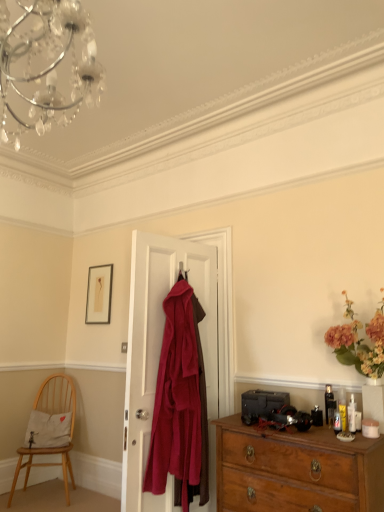
This screenshot has width=384, height=512. Identify the location of wooden chest of drawers at lower right. (296, 470).

At what (x,y) coordinates should I click in order to perform the action: click on matte gold picture frame at upper left. Please return your answer as a coordinate pair (x, y). This screenshot has height=512, width=384. Looking at the image, I should click on 99,294.

Is velvet burgundy coat at center a part of light wood chair at lower left?

That's incorrect, velvet burgundy coat at center is not inside light wood chair at lower left.

Is light wood chair at lower left touching velvet burgundy coat at center?

No.

Is light wood chair at lower left to the right of velvet burgundy coat at center from the viewer's perspective?

No, light wood chair at lower left is not to the right of velvet burgundy coat at center.

Is light wood chair at lower left in front of or behind velvet burgundy coat at center in the image?

In the image, light wood chair at lower left appears behind velvet burgundy coat at center.

Can you see wooden chest of drawers at lower right touching matte gold picture frame at upper left?

They are not placed beside each other.

Is wooden chest of drawers at lower right taller or shorter than matte gold picture frame at upper left?

Considering their sizes, wooden chest of drawers at lower right has more height than matte gold picture frame at upper left.

Locate an element on the screen. picture frame above the wooden chest of drawers at lower right (from a real-world perspective) is located at coordinates (99, 294).

How many degrees apart are the facing directions of wooden chest of drawers at lower right and matte gold picture frame at upper left?

wooden chest of drawers at lower right and matte gold picture frame at upper left are facing 0.288 degrees away from each other.

Can you tell me how much matte gold picture frame at upper left and velvet burgundy coat at center differ in facing direction?

They differ by 96.5 degrees in their facing directions.

Is matte gold picture frame at upper left positioned with its back to velvet burgundy coat at center?

No, matte gold picture frame at upper left is not facing the opposite direction of velvet burgundy coat at center.

Is point (103, 317) closer to viewer compared to point (159, 303)?

No.

Consider the image. Does matte gold picture frame at upper left have a lesser height compared to velvet burgundy coat at center?

Indeed, matte gold picture frame at upper left has a lesser height compared to velvet burgundy coat at center.

From the image's perspective, is wooden chest of drawers at lower right above or below velvet burgundy coat at center?

Based on their image positions, wooden chest of drawers at lower right is located beneath velvet burgundy coat at center.

Can you confirm if wooden chest of drawers at lower right is thinner than velvet burgundy coat at center?

Incorrect, the width of wooden chest of drawers at lower right is not less than that of velvet burgundy coat at center.

Based on their sizes in the image, would you say wooden chest of drawers at lower right is bigger or smaller than velvet burgundy coat at center?

Considering their sizes, wooden chest of drawers at lower right takes up more space than velvet burgundy coat at center.

Is wooden chest of drawers at lower right not within velvet burgundy coat at center?

Absolutely, wooden chest of drawers at lower right is external to velvet burgundy coat at center.

Between velvet burgundy coat at center and light wood chair at lower left, which one has less height?

With less height is light wood chair at lower left.

Can you tell me how much velvet burgundy coat at center and light wood chair at lower left differ in facing direction?

The angular difference between velvet burgundy coat at center and light wood chair at lower left is 141 degrees.

Is light wood chair at lower left at the back of velvet burgundy coat at center?

No, velvet burgundy coat at center is not facing away from light wood chair at lower left.

Between velvet burgundy coat at center and light wood chair at lower left, which one appears on the left side from the viewer's perspective?

light wood chair at lower left is more to the left.

Would you consider wooden chest of drawers at lower right to be distant from light wood chair at lower left?

wooden chest of drawers at lower right is far away from light wood chair at lower left.

Can you confirm if wooden chest of drawers at lower right is positioned to the left of light wood chair at lower left?

No.

Is wooden chest of drawers at lower right oriented away from light wood chair at lower left?

No.

Is velvet burgundy coat at center positioned behind wooden chest of drawers at lower right?

Yes, velvet burgundy coat at center is behind wooden chest of drawers at lower right.

Which is less distant, (144,237) or (299,497)?

The point (299,497) is more forward.

From a real-world perspective, between velvet burgundy coat at center and wooden chest of drawers at lower right, who is vertically lower?

wooden chest of drawers at lower right, from a real-world perspective.

Measure the distance from velvet burgundy coat at center to wooden chest of drawers at lower right.

velvet burgundy coat at center is 24.95 inches away from wooden chest of drawers at lower right.

I want to click on door on the right of light wood chair at lower left, so click(160, 350).

The height and width of the screenshot is (512, 384). Find the location of `the chest of drawers lying below the matte gold picture frame at upper left (from the image's perspective)`. the chest of drawers lying below the matte gold picture frame at upper left (from the image's perspective) is located at coordinates (296, 470).

Based on their spatial positions, is wooden chest of drawers at lower right or matte gold picture frame at upper left closer to light wood chair at lower left?

Among the two, matte gold picture frame at upper left is located nearer to light wood chair at lower left.

Looking at the image, which one is located further to wooden chest of drawers at lower right, matte gold picture frame at upper left or light wood chair at lower left?

Among the two, light wood chair at lower left is located further to wooden chest of drawers at lower right.

Based on their spatial positions, is velvet burgundy coat at center or matte gold picture frame at upper left further from wooden chest of drawers at lower right?

Based on the image, matte gold picture frame at upper left appears to be further to wooden chest of drawers at lower right.

From the image, which object appears to be farther from wooden chest of drawers at lower right, velvet burgundy coat at center or light wood chair at lower left?

Among the two, light wood chair at lower left is located further to wooden chest of drawers at lower right.

From the image, which object appears to be nearer to matte gold picture frame at upper left, light wood chair at lower left or wooden chest of drawers at lower right?

The object closer to matte gold picture frame at upper left is light wood chair at lower left.

Which object lies further to the anchor point wooden chest of drawers at lower right, matte gold picture frame at upper left or velvet burgundy coat at center?

Based on the image, matte gold picture frame at upper left appears to be further to wooden chest of drawers at lower right.

In the scene shown: Considering their positions, is light wood chair at lower left positioned further to matte gold picture frame at upper left than velvet burgundy coat at center?

Among the two, velvet burgundy coat at center is located further to matte gold picture frame at upper left.

Looking at the image, which one is located closer to velvet burgundy coat at center, matte gold picture frame at upper left or wooden chest of drawers at lower right?

The object closer to velvet burgundy coat at center is wooden chest of drawers at lower right.

At what (x,y) coordinates should I click in order to perform the action: click on door located between wooden chest of drawers at lower right and matte gold picture frame at upper left in the depth direction. Please return your answer as a coordinate pair (x, y). Image resolution: width=384 pixels, height=512 pixels. Looking at the image, I should click on (160, 350).

Identify the location of door between light wood chair at lower left and wooden chest of drawers at lower right from left to right. This screenshot has height=512, width=384. coord(160,350).

Locate an element on the screen. Image resolution: width=384 pixels, height=512 pixels. chair between wooden chest of drawers at lower right and matte gold picture frame at upper left along the z-axis is located at coordinates (57, 396).

Where is `chair between velvet burgundy coat at center and matte gold picture frame at upper left along the z-axis`? The width and height of the screenshot is (384, 512). chair between velvet burgundy coat at center and matte gold picture frame at upper left along the z-axis is located at coordinates 57,396.